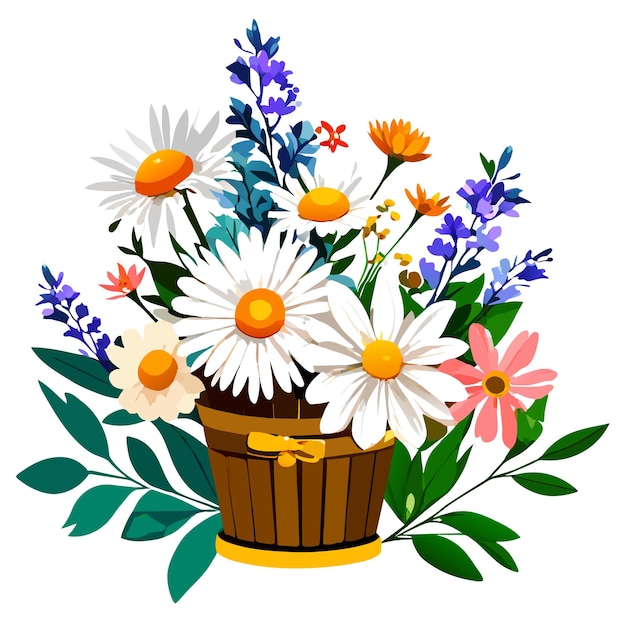
I want to click on basket, so click(289, 510).